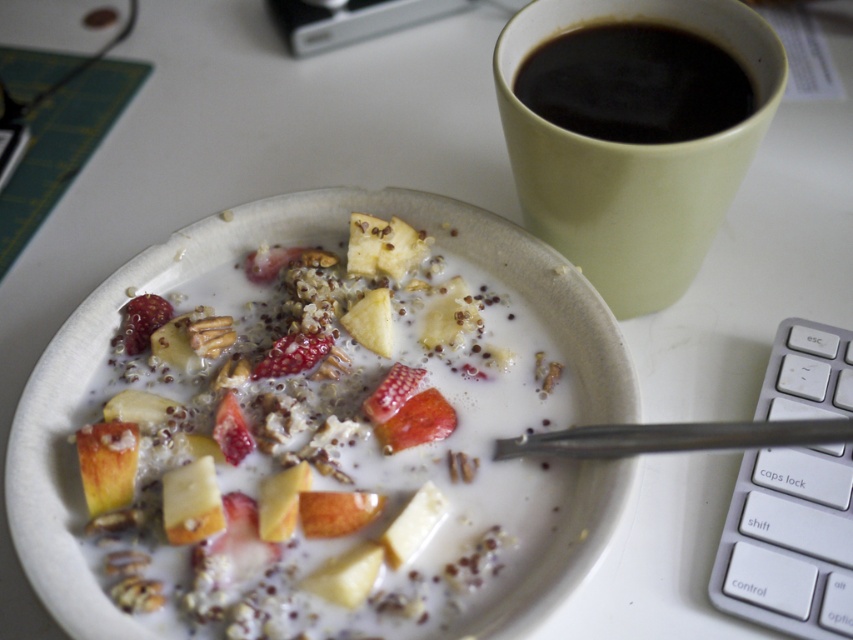
In the scene shown: You are setting up a breakfast table and have a matte green cup at upper right and a black matte cup at upper right. If you want to place a saucer between them, what is the minimum diameter the saucer should have to fit between the two cups?

The matte green cup at upper right and black matte cup at upper right are 2.55 inches apart from each other. Therefore, the saucer should have a diameter of at least 2.55 inches to fit between them.

You are a barista preparing drinks and see both the matte green cup at upper right and the black matte cup at upper right. Which cup should you choose if you need to pour a hot beverage that requires a wider rim to prevent spills?

The matte green cup at upper right might be wider than the black matte cup at upper right, so it is better to choose the matte green cup at upper right for pouring hot beverages to prevent spills.

You are setting up a breakfast table and need to place both the matte green cup at upper right and the black matte cup at upper right. According to the image, which cup should be positioned on the left side when arranging them side by side?

The black matte cup at upper right should be positioned on the left side because the matte green cup at upper right is to the right of it in the image.